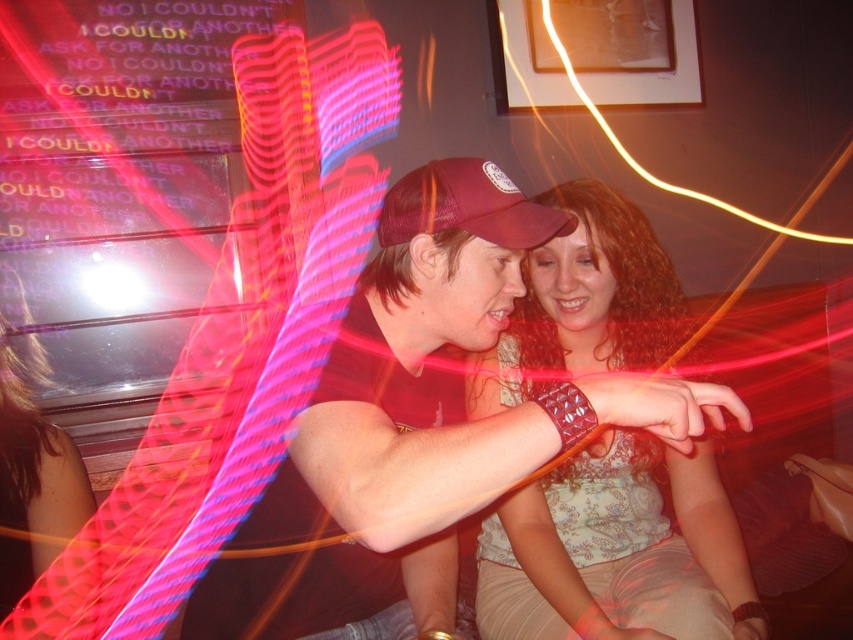
Between light blue floral blouse at center and matte black dress at lower left, which one is positioned lower?

matte black dress at lower left is lower down.

Does light blue floral blouse at center have a greater width compared to matte black dress at lower left?

Yes.

Identify the location of light blue floral blouse at center. This screenshot has height=640, width=853. (618, 552).

The image size is (853, 640). What do you see at coordinates (33, 477) in the screenshot? I see `matte black dress at lower left` at bounding box center [33, 477].

Can you confirm if matte black dress at lower left is positioned to the left of maroon mesh baseball cap at center?

Correct, you'll find matte black dress at lower left to the left of maroon mesh baseball cap at center.

Is point (33, 566) positioned behind point (537, 237)?

That is True.

This screenshot has height=640, width=853. What are the coordinates of `matte black dress at lower left` in the screenshot? It's located at (33, 477).

Does light blue floral blouse at center appear over maroon mesh baseball cap at center?

No.

In the scene shown: Who is taller, light blue floral blouse at center or maroon mesh baseball cap at center?

Standing taller between the two is light blue floral blouse at center.

The height and width of the screenshot is (640, 853). In order to click on light blue floral blouse at center in this screenshot , I will do `click(618, 552)`.

Where is `light blue floral blouse at center`? The height and width of the screenshot is (640, 853). light blue floral blouse at center is located at coordinates (618, 552).